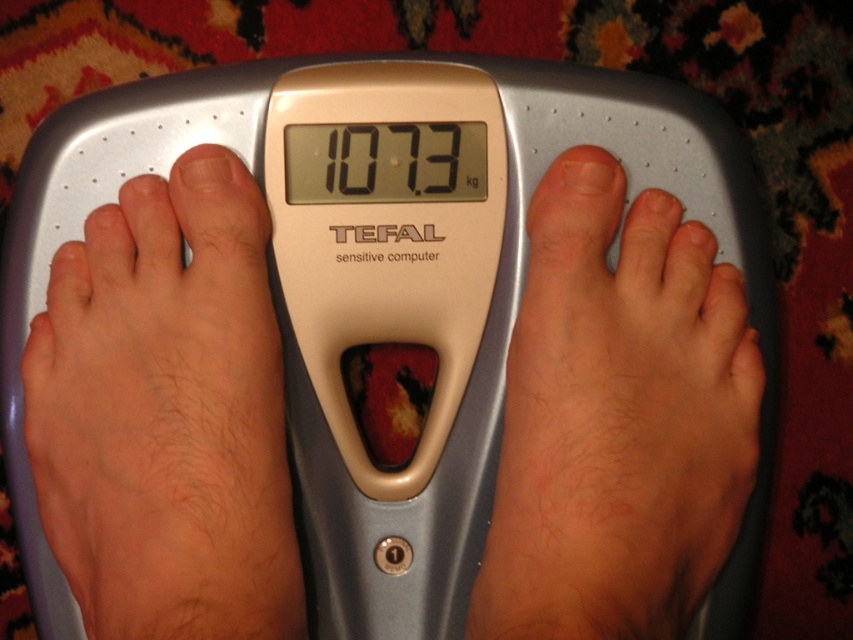
You are standing on the TEFAL scale and want to move your right foot forward to check your weight. Your current right foot is at point A, which is point (170, 468). Your left foot is at point B, which is point (563, 420). If you move your right foot forward, will it pass in front of your left foot?

Point (170, 468) is in front of point (563, 420), so moving your right foot forward from point A would mean it is already positioned in front of your left foot at point B. Therefore, moving it further forward would still keep it ahead of the left foot.